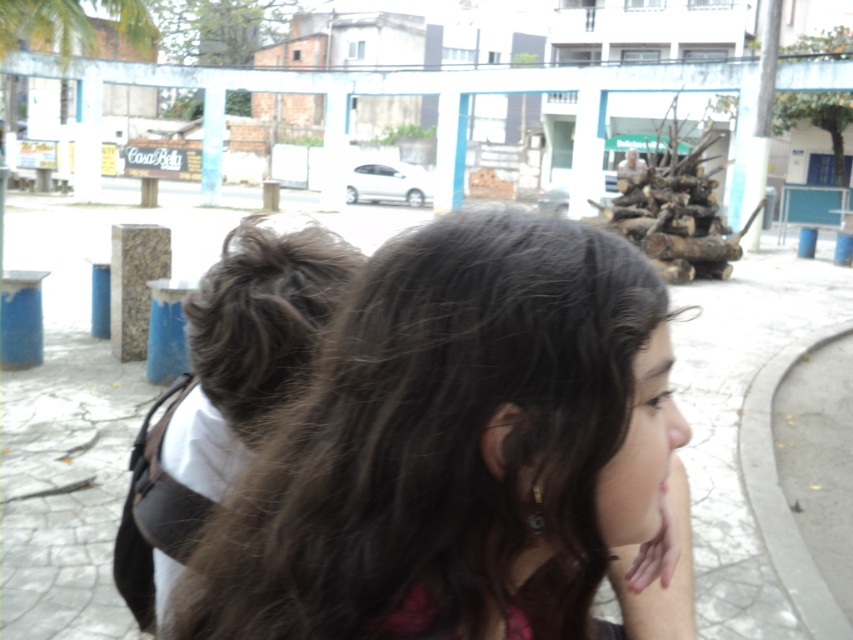
Find the location of a particular element. This screenshot has width=853, height=640. dark brown hair at center is located at coordinates (463, 452).

Which is above, dark brown hair at center or green leafy palm tree at upper left?

green leafy palm tree at upper left

You are a GUI agent. You are given a task and a screenshot of the screen. Output one action in this format:
    pyautogui.click(x=<x>, y=<y>)
    Task: Click on the dark brown hair at center
    
    Given the screenshot: What is the action you would take?
    pyautogui.click(x=463, y=452)